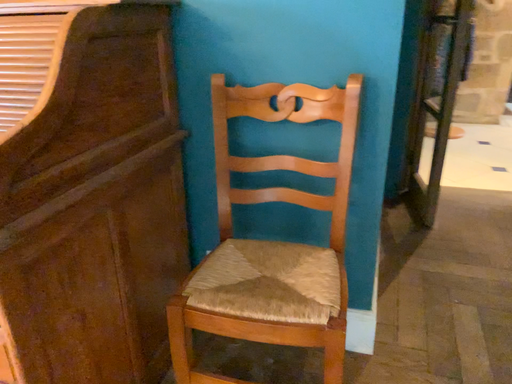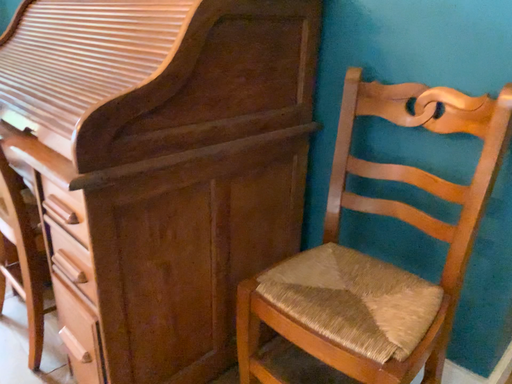
Question: How did the camera likely rotate when shooting the video?

Choices:
 (A) rotated left
 (B) rotated right

Answer: (A)